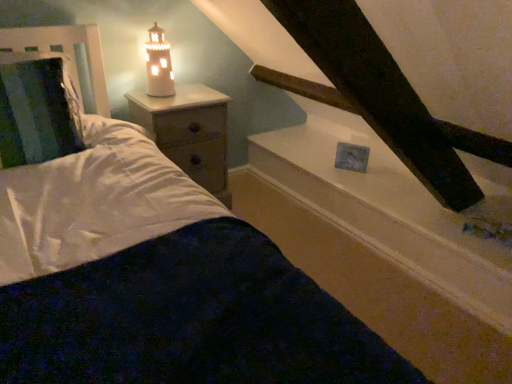
Question: Relative to white soft bedding at center, is white ceramic lighthouse at upper left in front or behind?

Choices:
 (A) behind
 (B) front

Answer: (A)

Question: Do you think white ceramic lighthouse at upper left is within white soft bedding at center, or outside of it?

Choices:
 (A) inside
 (B) outside

Answer: (B)

Question: Estimate the real-world distances between objects in this image. Which object is farther from the metallic silver headboard at left?

Choices:
 (A) white soft bedding at center
 (B) wooden nightstand at left
 (C) white glossy window sill at upper center
 (D) white ceramic lighthouse at upper left

Answer: (A)

Question: Which object is the closest to the white ceramic lighthouse at upper left?

Choices:
 (A) white glossy window sill at upper center
 (B) metallic silver headboard at left
 (C) wooden nightstand at left
 (D) white soft bedding at center

Answer: (C)